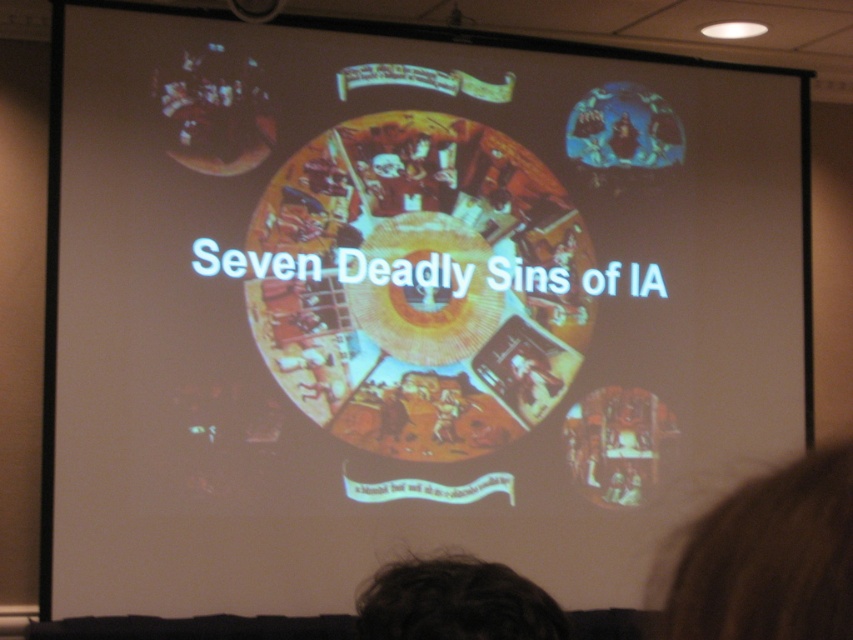
Does brown fuzzy hair at lower right have a greater width compared to dark hair at lower center?

No.

Between brown fuzzy hair at lower right and dark hair at lower center, which one has less height?

brown fuzzy hair at lower right

Locate an element on the screen. Image resolution: width=853 pixels, height=640 pixels. brown fuzzy hair at lower right is located at coordinates (772, 557).